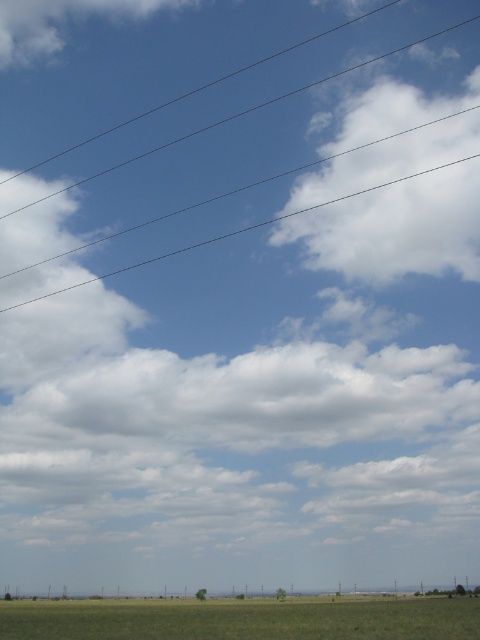
Question: Does white fluffy cloud at upper right come behind transparent wire at upper center?

Choices:
 (A) no
 (B) yes

Answer: (A)

Question: Which object is positioned farthest from the green grass at lower center?

Choices:
 (A) transparent wire at upper center
 (B) green grassland at lower center
 (C) white fluffy cloud at upper right
 (D) white fluffy cloud at center

Answer: (C)

Question: Does white fluffy cloud at center have a larger size compared to transparent wire at upper center?

Choices:
 (A) yes
 (B) no

Answer: (B)

Question: Which object is farther from the camera taking this photo?

Choices:
 (A) green grassland at lower center
 (B) white fluffy cloud at center
 (C) transparent wire at upper center

Answer: (C)

Question: Is the position of white fluffy cloud at upper right more distant than that of green grass at lower center?

Choices:
 (A) yes
 (B) no

Answer: (A)

Question: Which point is farther from the camera taking this photo?

Choices:
 (A) (113, 232)
 (B) (466, 388)
 (C) (458, 588)
 (D) (62, 611)

Answer: (B)